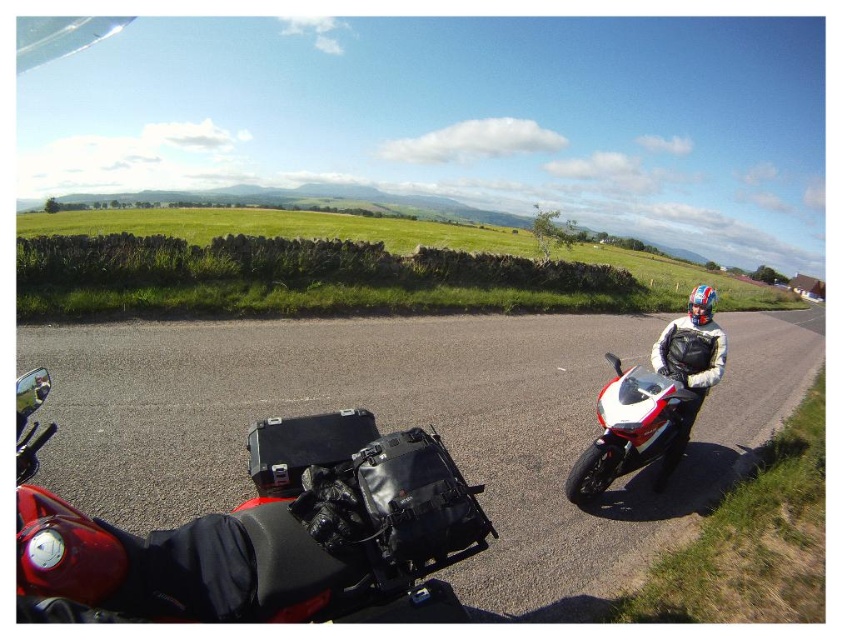
Question: Which point is closer to the camera?

Choices:
 (A) (686, 381)
 (B) (633, 376)

Answer: (B)

Question: Is shiny black motorcycle at center thinner than white leather jacket at right?

Choices:
 (A) yes
 (B) no

Answer: (A)

Question: Which of these objects is positioned closest to the white leather jacket at right?

Choices:
 (A) green stone wall at center
 (B) shiny black motorcycle at center
 (C) white glossy sportbike at right

Answer: (C)

Question: Among these objects, which one is farthest from the camera?

Choices:
 (A) green stone wall at center
 (B) white leather jacket at right
 (C) white glossy sportbike at right
 (D) shiny black motorcycle at center

Answer: (A)

Question: Does shiny black motorcycle at center appear on the right side of white glossy sportbike at right?

Choices:
 (A) yes
 (B) no

Answer: (B)

Question: Can you confirm if green stone wall at center is bigger than white leather jacket at right?

Choices:
 (A) no
 (B) yes

Answer: (B)